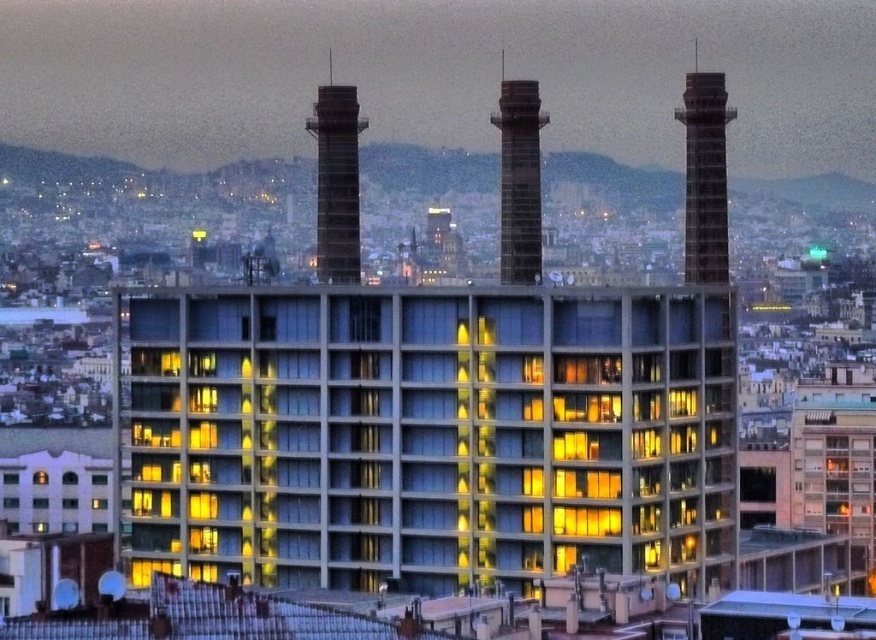
Based on the photo, does concrete building at center have a greater height compared to rustic brick chimney at upper right?

No.

Who is more distant from viewer, [456,364] or [686,276]?

Point [686,276]

Who is more forward, (372, 502) or (697, 182)?

Point (372, 502)

The image size is (876, 640). Find the location of `concrete building at center`. concrete building at center is located at coordinates (426, 435).

Based on the photo, is rustic brick chimney at upper right smaller than concrete chimney at center?

Incorrect, rustic brick chimney at upper right is not smaller in size than concrete chimney at center.

Can you confirm if rustic brick chimney at upper right is positioned to the left of concrete chimney at center?

Incorrect, rustic brick chimney at upper right is not on the left side of concrete chimney at center.

Is point (690, 161) positioned in front of point (348, 212)?

Yes, it is.

At what (x,y) coordinates should I click in order to perform the action: click on rustic brick chimney at upper right. Please return your answer as a coordinate pair (x, y). Looking at the image, I should click on (705, 173).

Is the position of concrete chimney at center more distant than that of smooth concrete chimney at center?

No, it is not.

What do you see at coordinates (336, 180) in the screenshot? I see `concrete chimney at center` at bounding box center [336, 180].

Locate an element on the screen. concrete chimney at center is located at coordinates (336, 180).